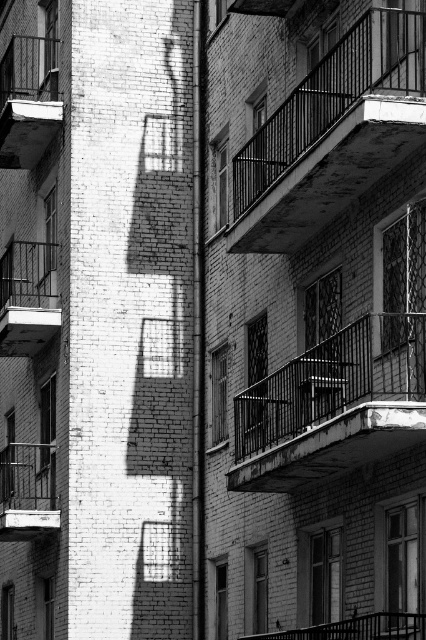
You are a window washer working on the left building and need to move from the rusty metal balcony at upper right to the rusty metal balcony at center. Which balcony is wider, and why is this important for your safety?

The rusty metal balcony at upper right is wider than the rusty metal balcony at center. This is important for safety because a wider balcony provides more stable footing and reduces the risk of slipping or losing balance during the move.

You are a window washer standing on the ground floor of the building. You need to clean both the rusty metal balcony at upper right and the rusty metal balcony at center. Which balcony will require you to use a taller ladder?

The rusty metal balcony at upper right has a greater height compared to the rusty metal balcony at center, so you will need a taller ladder to reach the rusty metal balcony at upper right.